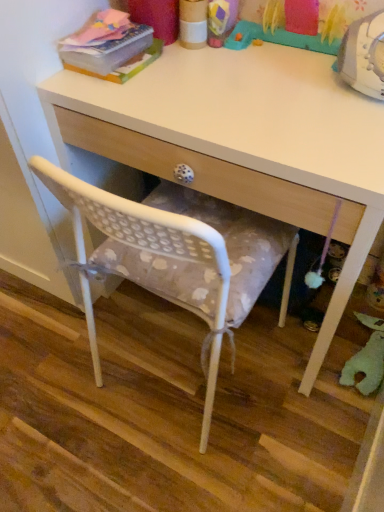
Question: Is there a large distance between green felt toy at lower right, which is the 2th toy in left-to-right order, and matte pink book at upper left?

Choices:
 (A) no
 (B) yes

Answer: (A)

Question: Considering the relative sizes of green felt toy at lower right, marked as the 1th toy in a back-to-front arrangement, and matte pink book at upper left in the image provided, is green felt toy at lower right, marked as the 1th toy in a back-to-front arrangement, smaller than matte pink book at upper left?

Choices:
 (A) yes
 (B) no

Answer: (B)

Question: Is green felt toy at lower right, marked as the first toy in a right-to-left arrangement, further to the viewer compared to matte pink book at upper left?

Choices:
 (A) no
 (B) yes

Answer: (B)

Question: Considering the relative sizes of green felt toy at lower right, marked as the first toy in a right-to-left arrangement, and matte pink book at upper left in the image provided, is green felt toy at lower right, marked as the first toy in a right-to-left arrangement, taller than matte pink book at upper left?

Choices:
 (A) yes
 (B) no

Answer: (B)

Question: Does green felt toy at lower right, placed as the second toy when sorted from front to back, have a lesser width compared to matte pink book at upper left?

Choices:
 (A) yes
 (B) no

Answer: (B)

Question: Is green felt toy at lower right, placed as the 2th toy when sorted from top to bottom, oriented towards matte pink book at upper left?

Choices:
 (A) yes
 (B) no

Answer: (B)

Question: Is white fabric cushion at center closer to camera compared to white wood desk at center?

Choices:
 (A) yes
 (B) no

Answer: (B)

Question: From a real-world perspective, is white fabric cushion at center on top of white wood desk at center?

Choices:
 (A) no
 (B) yes

Answer: (A)

Question: Can you confirm if white fabric cushion at center is smaller than white wood desk at center?

Choices:
 (A) yes
 (B) no

Answer: (A)

Question: Considering the relative sizes of white fabric cushion at center and white wood desk at center in the image provided, is white fabric cushion at center bigger than white wood desk at center?

Choices:
 (A) no
 (B) yes

Answer: (A)

Question: Is white fabric cushion at center oriented towards white wood desk at center?

Choices:
 (A) no
 (B) yes

Answer: (A)

Question: Is white fabric cushion at center touching white wood desk at center?

Choices:
 (A) no
 (B) yes

Answer: (A)

Question: From the image's perspective, is green felt toy at lower right, the 1th toy when ordered from bottom to top, above plastic toy at upper center, which appears as the second toy when ordered from the bottom?

Choices:
 (A) yes
 (B) no

Answer: (B)